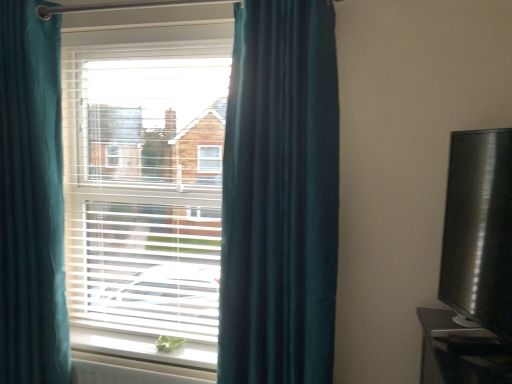
Question: Does white plastic radiator at lower center have a greater width compared to black glossy tv at right?

Choices:
 (A) no
 (B) yes

Answer: (A)

Question: From the image's perspective, is white plastic radiator at lower center located beneath black glossy tv at right?

Choices:
 (A) no
 (B) yes

Answer: (B)

Question: Is white plastic radiator at lower center outside black glossy tv at right?

Choices:
 (A) yes
 (B) no

Answer: (A)

Question: Does white plastic radiator at lower center come in front of black glossy tv at right?

Choices:
 (A) no
 (B) yes

Answer: (A)

Question: Is white plastic radiator at lower center far away from black glossy tv at right?

Choices:
 (A) no
 (B) yes

Answer: (B)

Question: Could black glossy tv at right be considered to be inside white plastic radiator at lower center?

Choices:
 (A) yes
 (B) no

Answer: (B)

Question: From the image's perspective, is white matte window sill at lower center beneath teal velvet curtain at left, which is the 2th curtain in left-to-right order?

Choices:
 (A) yes
 (B) no

Answer: (A)

Question: Is white matte window sill at lower center wider than teal velvet curtain at left, which is the 2th curtain in left-to-right order?

Choices:
 (A) yes
 (B) no

Answer: (B)

Question: Can you confirm if white matte window sill at lower center is bigger than teal velvet curtain at left, the first curtain positioned from the right?

Choices:
 (A) no
 (B) yes

Answer: (A)

Question: From a real-world perspective, is white matte window sill at lower center located beneath teal velvet curtain at left, which is the 2th curtain in left-to-right order?

Choices:
 (A) yes
 (B) no

Answer: (A)

Question: Is white matte window sill at lower center to the right of teal velvet curtain at left, which is the 2th curtain in left-to-right order, from the viewer's perspective?

Choices:
 (A) no
 (B) yes

Answer: (A)

Question: Is white matte window sill at lower center taller than teal velvet curtain at left, the first curtain positioned from the right?

Choices:
 (A) yes
 (B) no

Answer: (B)

Question: Is white plastic blinds at center facing away from white plastic radiator at lower center?

Choices:
 (A) yes
 (B) no

Answer: (B)